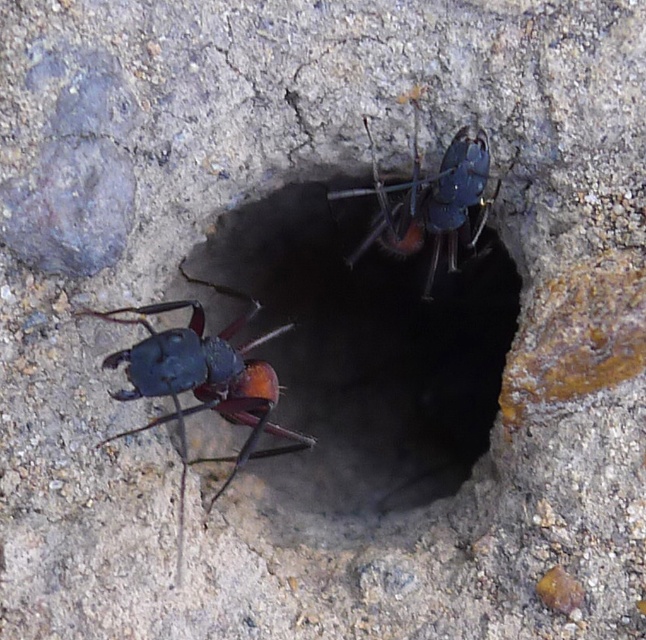
You are a tiny explorer standing near the shiny blue ant at upper center and want to drop a small pebble into the smooth concrete hole at center. Can you do this without moving from your current position?

The smooth concrete hole at center is positioned under the shiny blue ant at upper center, so yes, you can drop the pebble into the hole without moving since the hole is directly below the ant.

You are a tiny explorer who wants to crawl through the smooth concrete hole at center. Given that your body is the same size as the shiny black ant at left, will you fit through the hole?

The smooth concrete hole at center has a larger size compared to shiny black ant at left, so yes, you can fit through the hole since it is bigger than the ant.

You are a tiny explorer who needs to reach the smooth concrete hole at center from the shiny black ant at left. Given that you can only move in a straight line and your maximum reach is 8 inches, will you be able to reach the hole?

The distance between the smooth concrete hole at center and the shiny black ant at left is 8.67 inches, which exceeds your 8 inches maximum reach. Therefore, you cannot reach the hole directly in a straight line.